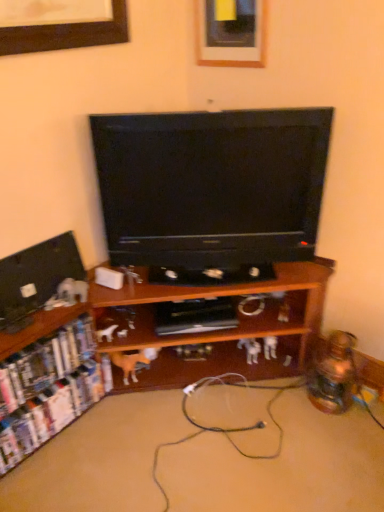
Where is `vacant area that lies in front of white cardboard shelf at lower left, positioned as the second shelf in right-to-left order`? Image resolution: width=384 pixels, height=512 pixels. vacant area that lies in front of white cardboard shelf at lower left, positioned as the second shelf in right-to-left order is located at coordinates (52, 479).